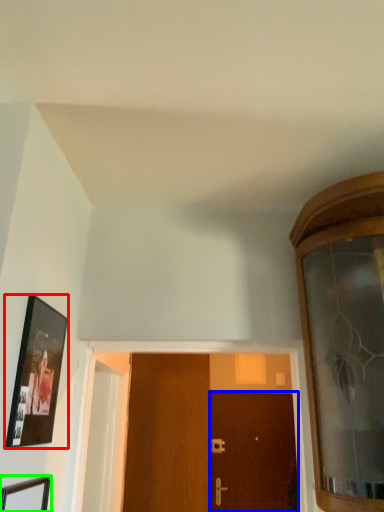
Question: Considering the real-world distances, which object is farthest from picture frame (highlighted by a red box)? door (highlighted by a blue box) or picture frame (highlighted by a green box)?

Choices:
 (A) door
 (B) picture frame

Answer: (A)